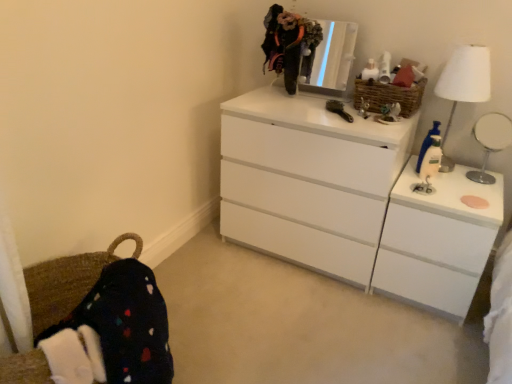
You are a GUI agent. You are given a task and a screenshot of the screen. Output one action in this format:
    pyautogui.click(x=<x>, y=<y>)
    Task: Click on the empty space that is ontop of white fabric lampshade at right (from a real-world perspective)
    The width and height of the screenshot is (512, 384).
    Given the screenshot: What is the action you would take?
    pyautogui.click(x=473, y=48)